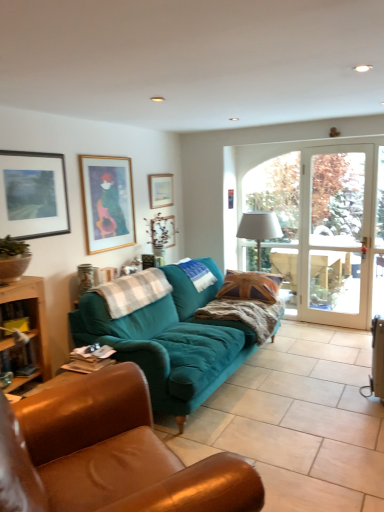
Question: Is wooden picture frame at upper center, acting as the third picture frame starting from the front, looking in the opposite direction of matte black picture frame at upper left, which is the first picture frame in front-to-back order?

Choices:
 (A) no
 (B) yes

Answer: (A)

Question: Can you confirm if wooden picture frame at upper center, acting as the 3th picture frame starting from the left, is taller than matte black picture frame at upper left, the first picture frame viewed from the left?

Choices:
 (A) yes
 (B) no

Answer: (B)

Question: Is wooden picture frame at upper center, acting as the 3th picture frame starting from the left, smaller than matte black picture frame at upper left, which is the fourth picture frame in right-to-left order?

Choices:
 (A) yes
 (B) no

Answer: (A)

Question: From a real-world perspective, is wooden picture frame at upper center, acting as the third picture frame starting from the front, under matte black picture frame at upper left, which is the fourth picture frame in right-to-left order?

Choices:
 (A) no
 (B) yes

Answer: (B)

Question: Is the position of wooden picture frame at upper center, acting as the 3th picture frame starting from the left, more distant than that of matte black picture frame at upper left, which is the fourth picture frame in right-to-left order?

Choices:
 (A) no
 (B) yes

Answer: (B)

Question: Is brown leather table at lower left in front of or behind matte black picture frame at upper left, which is the fourth picture frame in right-to-left order, in the image?

Choices:
 (A) front
 (B) behind

Answer: (A)

Question: From the image's perspective, is brown leather table at lower left located above or below matte black picture frame at upper left, which is the first picture frame in front-to-back order?

Choices:
 (A) above
 (B) below

Answer: (B)

Question: Is point (13, 287) closer or farther from the camera than point (43, 165)?

Choices:
 (A) closer
 (B) farther

Answer: (A)

Question: From a real-world perspective, is brown leather table at lower left above or below matte black picture frame at upper left, which appears as the fourth picture frame when viewed from the back?

Choices:
 (A) above
 (B) below

Answer: (B)

Question: From a real-world perspective, is teal fabric couch at center, the 2th studio couch in the back-to-front sequence, positioned above or below union jack fabric pillow at center?

Choices:
 (A) above
 (B) below

Answer: (B)

Question: Visually, is teal fabric couch at center, the 2th studio couch in the back-to-front sequence, positioned to the left or to the right of union jack fabric pillow at center?

Choices:
 (A) right
 (B) left

Answer: (B)

Question: Based on their sizes in the image, would you say teal fabric couch at center, positioned as the first studio couch in front-to-back order, is bigger or smaller than union jack fabric pillow at center?

Choices:
 (A) small
 (B) big

Answer: (B)

Question: From the image's perspective, relative to union jack fabric pillow at center, is teal fabric couch at center, positioned as the first studio couch in front-to-back order, above or below?

Choices:
 (A) below
 (B) above

Answer: (A)

Question: From the image's perspective, is union jack fabric pillow at center above or below white fabric lampshade at center?

Choices:
 (A) below
 (B) above

Answer: (A)

Question: Does point (261, 279) appear closer or farther from the camera than point (258, 245)?

Choices:
 (A) closer
 (B) farther

Answer: (A)